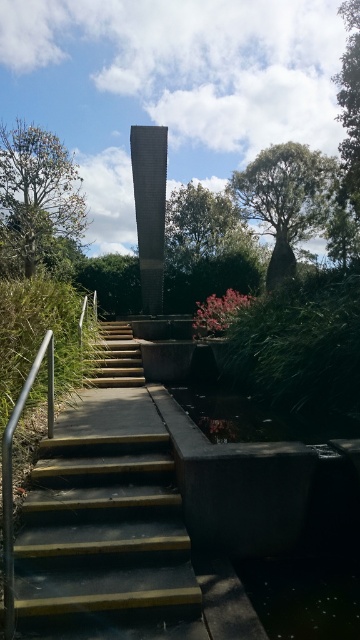
Who is taller, polished metal handrail at left or yellow wood stairs at center?

Standing taller between the two is polished metal handrail at left.

How far apart are polished metal handrail at left and yellow wood stairs at center?

polished metal handrail at left is 3.07 meters away from yellow wood stairs at center.

Describe the element at coordinates (11, 472) in the screenshot. I see `polished metal handrail at left` at that location.

Identify the location of polished metal handrail at left. (11, 472).

Does dark gray concrete stairs at center have a greater height compared to yellow wood stairs at center?

Yes, dark gray concrete stairs at center is taller than yellow wood stairs at center.

Who is lower down, dark gray concrete stairs at center or yellow wood stairs at center?

dark gray concrete stairs at center is below.

Identify the location of dark gray concrete stairs at center. Image resolution: width=360 pixels, height=640 pixels. (105, 518).

Between dark gray concrete stairs at center and polished metal handrail at left, which one appears on the left side from the viewer's perspective?

From the viewer's perspective, polished metal handrail at left appears more on the left side.

Is dark gray concrete stairs at center bigger than polished metal handrail at left?

Indeed, dark gray concrete stairs at center has a larger size compared to polished metal handrail at left.

This screenshot has height=640, width=360. Find the location of `dark gray concrete stairs at center`. dark gray concrete stairs at center is located at coordinates (105, 518).

In order to click on dark gray concrete stairs at center in this screenshot , I will do `click(105, 518)`.